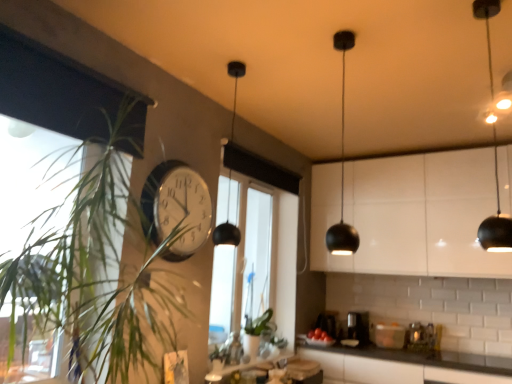
Question: From the image's perspective, relative to transparent glass window at center, is black matte pendant light at center above or below?

Choices:
 (A) above
 (B) below

Answer: (A)

Question: Considering the positions of black matte pendant light at center and transparent glass window at center in the image, is black matte pendant light at center wider or thinner than transparent glass window at center?

Choices:
 (A) thin
 (B) wide

Answer: (B)

Question: Which object is the closest to the red glossy tomatoes at lower center?

Choices:
 (A) black matte pendant light at upper right
 (B) white glossy clock at center
 (C) black matte pendant light at center
 (D) black matte pendant light at upper center
 (E) black plastic coffee machine at lower center

Answer: (E)

Question: Considering the real-world distances, which object is farthest from the black matte pendant light at upper right?

Choices:
 (A) black matte pendant light at upper center
 (B) black matte pendant light at center
 (C) black plastic coffee machine at lower center
 (D) white glossy cabinet at upper right
 (E) green leafy plant at left

Answer: (E)